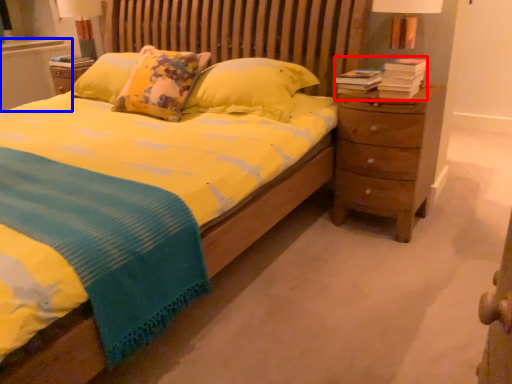
Question: Which of the following is the farthest to the observer, book (highlighted by a red box) or radiator (highlighted by a blue box)?

Choices:
 (A) book
 (B) radiator

Answer: (B)